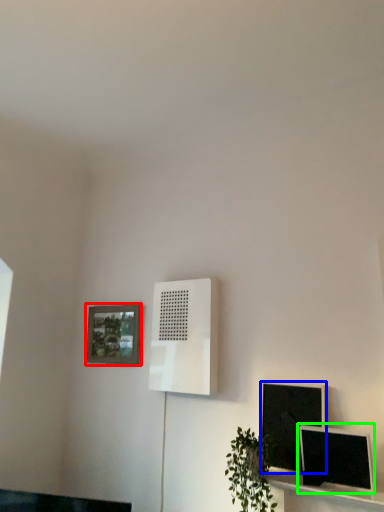
Question: Which object is the farthest from picture frame (highlighted by a red box)? Choose among these: computer monitor (highlighted by a blue box) or computer monitor (highlighted by a green box).

Choices:
 (A) computer monitor
 (B) computer monitor

Answer: (B)